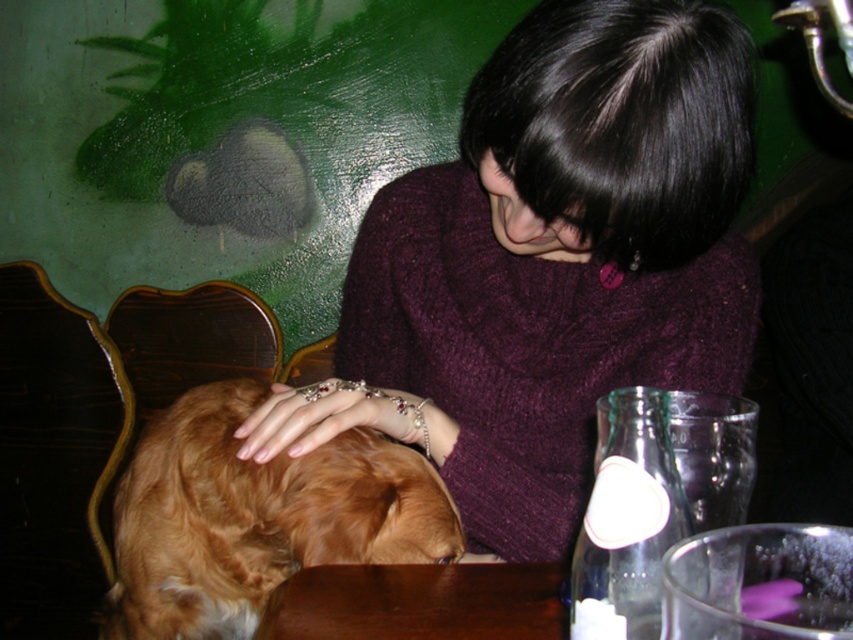
Is point (498, 161) closer to camera compared to point (426, 504)?

No, (498, 161) is behind (426, 504).

Looking at this image, is purple knitted sweater at center wider than brown fluffy dog at lower left?

Yes, purple knitted sweater at center is wider than brown fluffy dog at lower left.

Who is more distant from viewer, (x=556, y=237) or (x=131, y=504)?

The point (x=131, y=504) is behind.

You are a GUI agent. You are given a task and a screenshot of the screen. Output one action in this format:
    pyautogui.click(x=<x>, y=<y>)
    Task: Click on the purple knitted sweater at center
    The width and height of the screenshot is (853, 640).
    Given the screenshot: What is the action you would take?
    pyautogui.click(x=548, y=262)